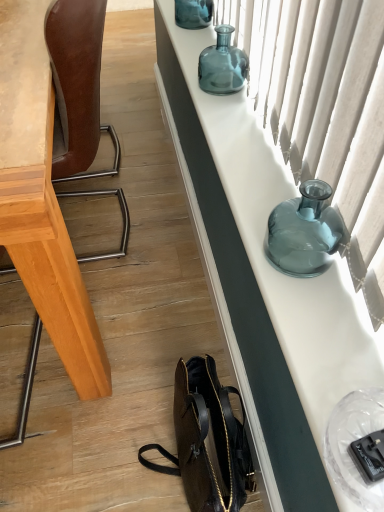
Locate an element on the screen. Image resolution: width=384 pixels, height=512 pixels. vacant space situated above matte glass vase at upper right (from a real-world perspective) is located at coordinates (253, 141).